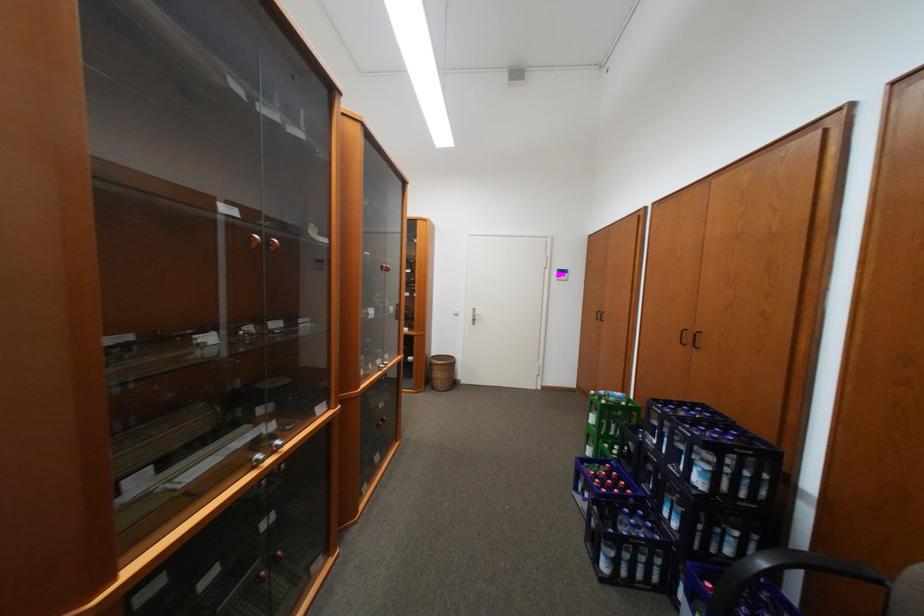
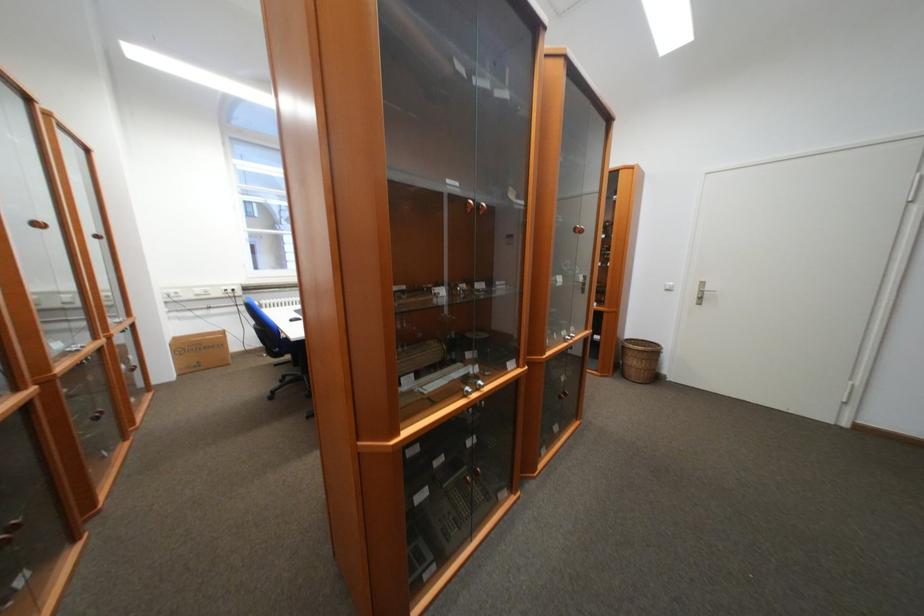
In the second image, find the point that corresponds to [265,444] in the first image.

(476, 379)